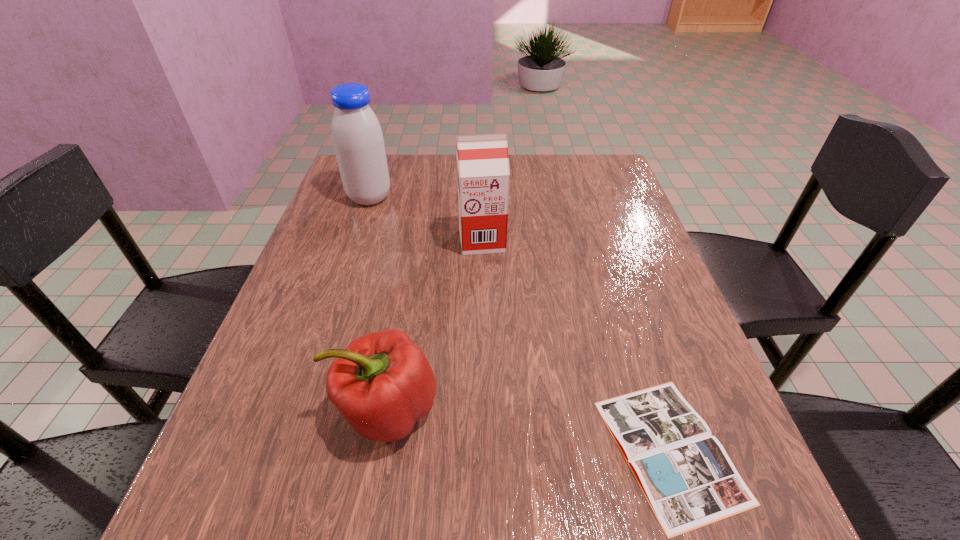
I want to click on the farthest object, so click(358, 141).

Locate an element on the screen. The image size is (960, 540). the farther soya milk is located at coordinates (x=358, y=141).

Find the location of `the third object from left to right`. the third object from left to right is located at coordinates (483, 176).

Where is `the third nearest object`? This screenshot has height=540, width=960. the third nearest object is located at coordinates [x=483, y=176].

I want to click on the third tallest object, so click(382, 383).

At what (x,y) coordinates should I click in order to perform the action: click on the rightmost object. Please return your answer as a coordinate pair (x, y). This screenshot has height=540, width=960. Looking at the image, I should click on (688, 479).

Locate an element on the screen. This screenshot has width=960, height=540. the shortest object is located at coordinates (688, 479).

Locate an element on the screen. The width and height of the screenshot is (960, 540). free spot located on the right of the farthest object is located at coordinates (425, 198).

What are the coordinates of `vacant point located on the right of the right soya milk` in the screenshot? It's located at (613, 240).

Locate an element on the screen. This screenshot has height=540, width=960. vacant space located on the front of the third tallest object is located at coordinates (369, 514).